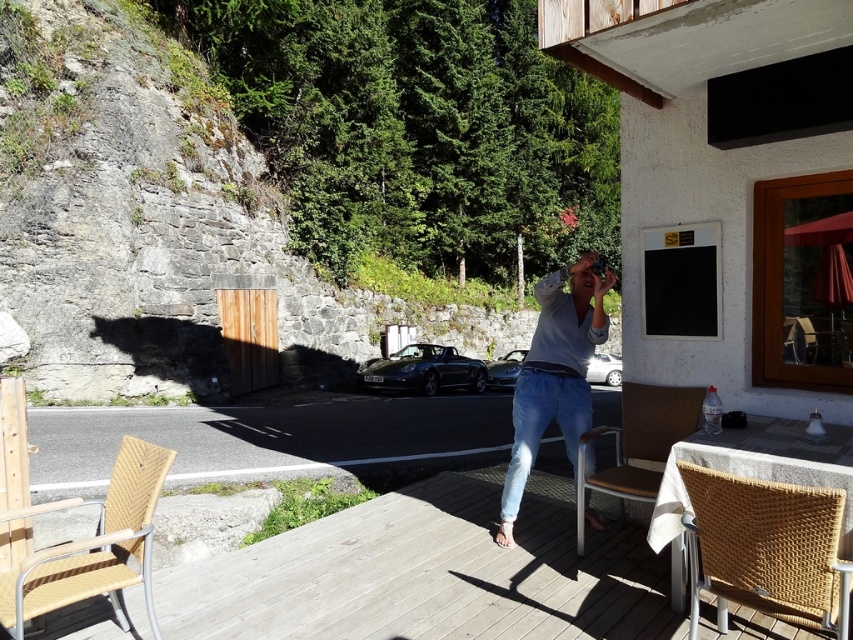
You are a photographer standing on the wooden deck at center. You want to take a photo of a distant landscape. Your camera is placed 8.90 feet away from you. Can you comfortably reach it without moving your feet?

The camera is 8.90 feet away from the wooden deck at center where you are standing. Since the distance is quite far for comfortable reach without moving, you would likely need to step closer or adjust your position to access it properly.

You are trying to decide whether to place a new plant stand on the wooden deck at center or next to the woven rattan chair at lower right. The plant stand requires a surface that is taller than the object it will be placed on. Based on the scene, which location should you choose?

The wooden deck at center is shorter than the woven rattan chair at lower right. Therefore, the plant stand should be placed next to the woven rattan chair at lower right because it is taller, meeting the requirement for the plant stand to be on a surface that is taller than the object.

You are standing at the center of the wooden deck and want to place a new plant pot exactly where the woven rattan chair at lower right is currently located. According to the coordinates provided, where should you place the plant pot?

You should place the plant pot at the coordinates point (766, 548) where the woven rattan chair at lower right is currently located.